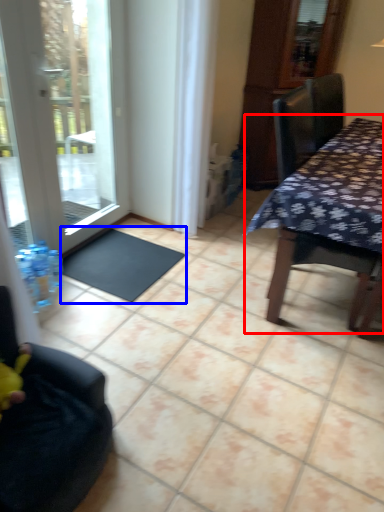
Question: Which object is closer to the camera taking this photo, table (highlighted by a red box) or doormat (highlighted by a blue box)?

Choices:
 (A) table
 (B) doormat

Answer: (A)